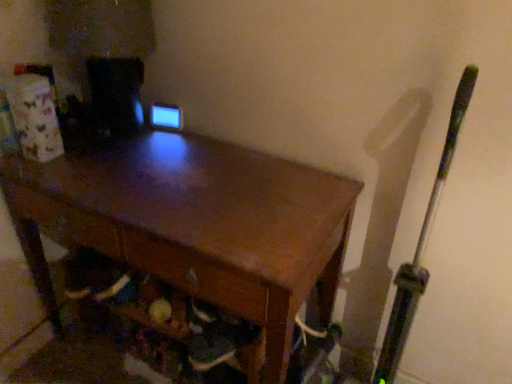
Question: Is wooden drawer at lower center aimed at green metallic bat at right?

Choices:
 (A) yes
 (B) no

Answer: (B)

Question: Does wooden drawer at lower center have a greater width compared to green metallic bat at right?

Choices:
 (A) no
 (B) yes

Answer: (B)

Question: From the image's perspective, is wooden drawer at lower center below green metallic bat at right?

Choices:
 (A) yes
 (B) no

Answer: (B)

Question: Is green metallic bat at right located within wooden drawer at lower center?

Choices:
 (A) yes
 (B) no

Answer: (B)

Question: Does wooden drawer at lower center appear on the left side of green metallic bat at right?

Choices:
 (A) no
 (B) yes

Answer: (B)

Question: Does wooden drawer at lower center have a smaller size compared to green metallic bat at right?

Choices:
 (A) no
 (B) yes

Answer: (B)

Question: Would you say wooden drawer at lower center is part of green metallic bat at right's contents?

Choices:
 (A) no
 (B) yes

Answer: (A)

Question: Could you tell me if green metallic bat at right is facing wooden drawer at lower center?

Choices:
 (A) yes
 (B) no

Answer: (B)

Question: From a real-world perspective, is green metallic bat at right physically below wooden drawer at lower center?

Choices:
 (A) yes
 (B) no

Answer: (B)

Question: Does green metallic bat at right lie behind wooden drawer at lower center?

Choices:
 (A) no
 (B) yes

Answer: (A)

Question: Considering the relative sizes of green metallic bat at right and wooden drawer at lower center in the image provided, is green metallic bat at right shorter than wooden drawer at lower center?

Choices:
 (A) yes
 (B) no

Answer: (B)

Question: Is green metallic bat at right positioned before wooden drawer at lower center?

Choices:
 (A) no
 (B) yes

Answer: (B)

Question: From the image's perspective, is green metallic bat at right below wooden desk at center?

Choices:
 (A) yes
 (B) no

Answer: (A)